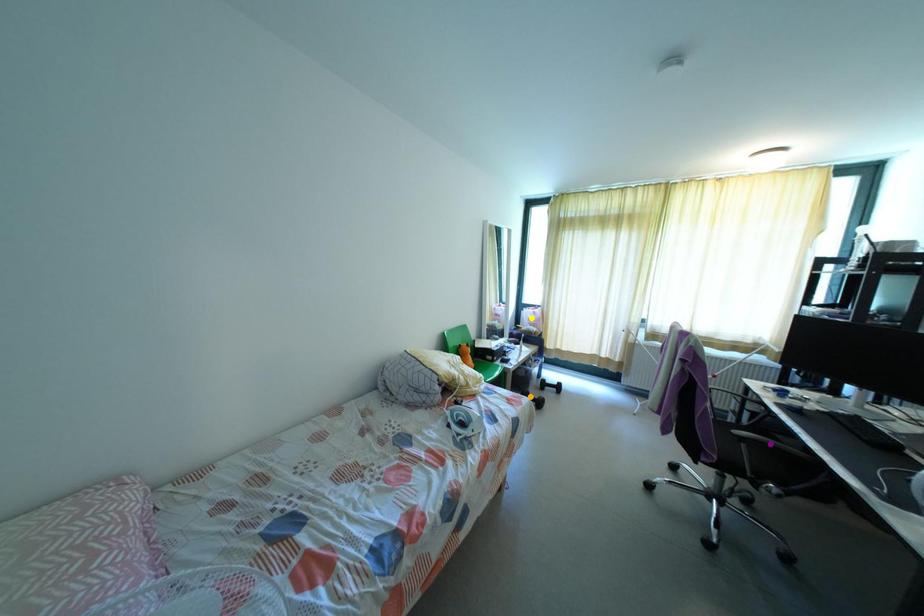
Order these from nearest to farthest:
purple point, orange point, yellow point

purple point < orange point < yellow point